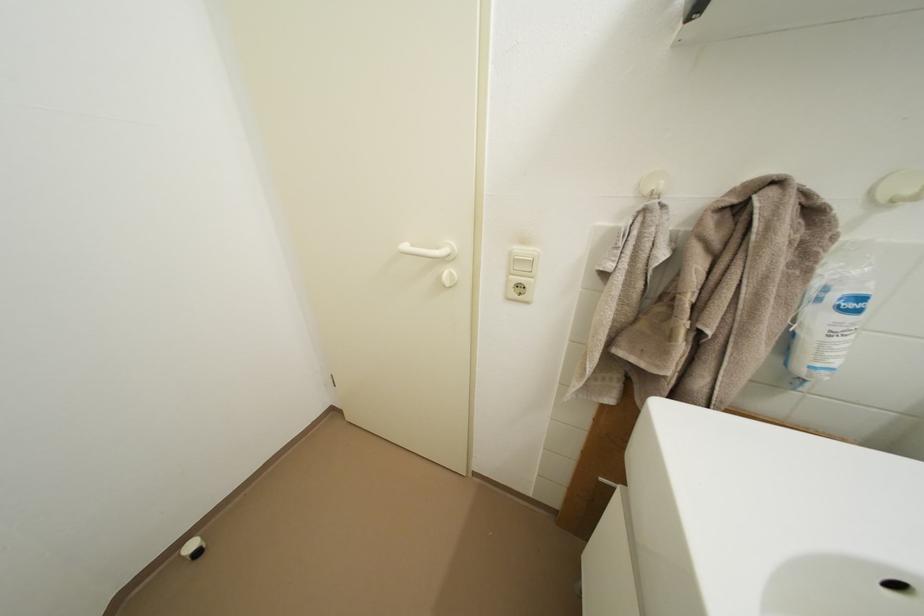
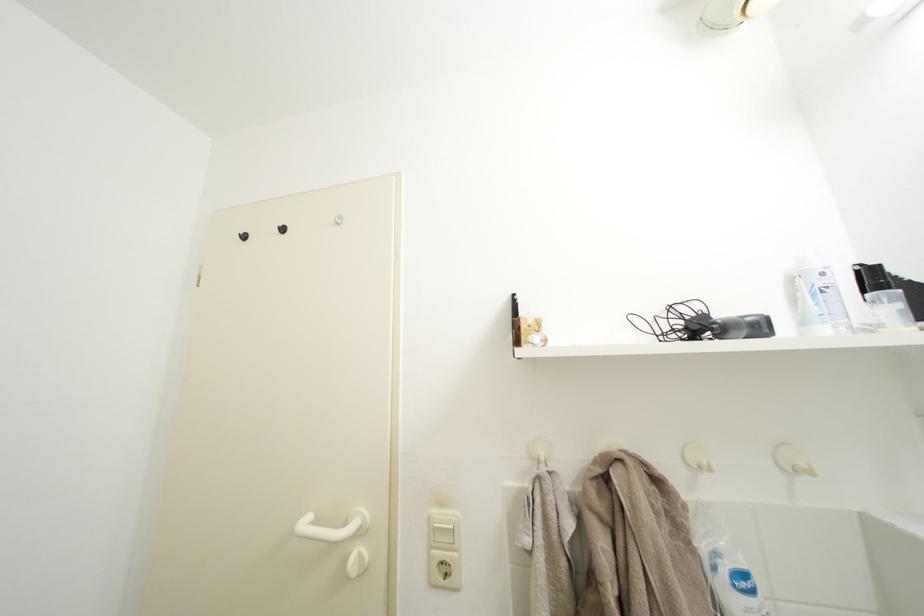
Locate, in the second image, the point that corresponds to point (519, 259) in the first image.

(438, 525)